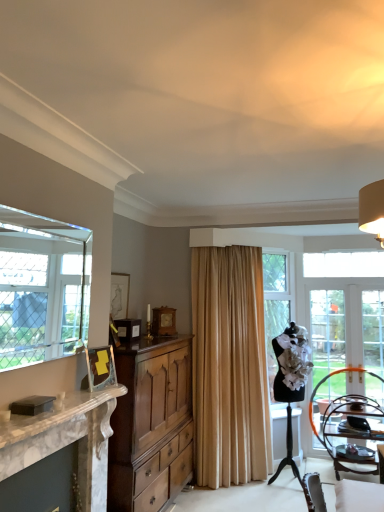
This screenshot has width=384, height=512. Find the location of `free spot below clear glass window at left (from a real-world perspective)`. free spot below clear glass window at left (from a real-world perspective) is located at coordinates (56, 399).